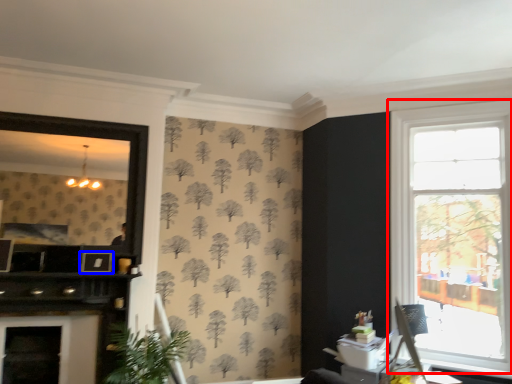
Question: Among these objects, which one is farthest to the camera, window (highlighted by a red box) or picture frame (highlighted by a blue box)?

Choices:
 (A) window
 (B) picture frame

Answer: (B)